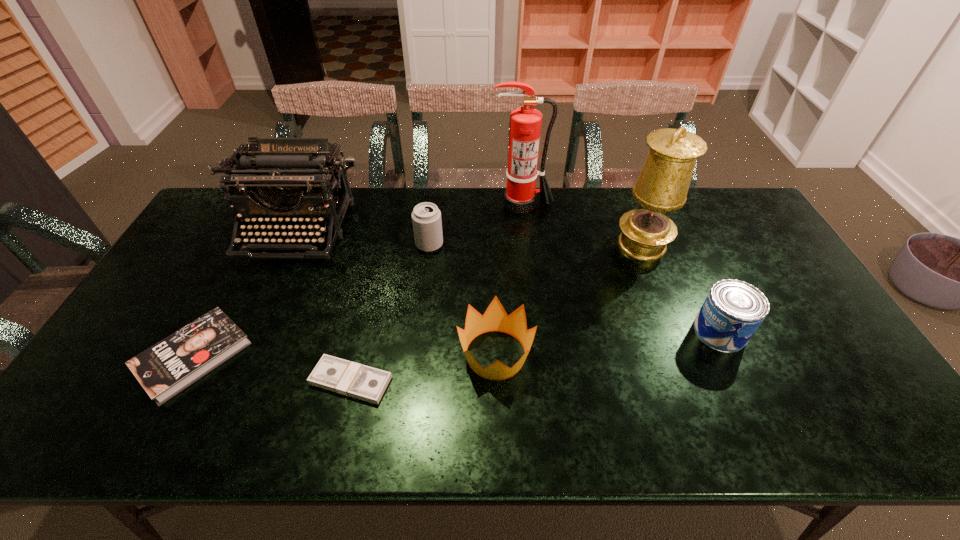
Locate an element on the screen. The height and width of the screenshot is (540, 960). object that is the seventh closest one to the fifth object from right to left is located at coordinates (733, 310).

Select which object appears as the seventh closest to the nearer can. Please provide its 2D coordinates. Your answer should be formatted as a tuple, i.e. [(x, y)], where the tuple contains the x and y coordinates of a point satisfying the conditions above.

[(165, 369)]

Locate an element on the screen. Image resolution: width=960 pixels, height=540 pixels. free space that satisfies the following two spatial constraints: 1. on the back side of the second shortest object; 2. on the right side of the fourth object from left to right is located at coordinates (253, 245).

You are a GUI agent. You are given a task and a screenshot of the screen. Output one action in this format:
    pyautogui.click(x=<x>, y=<y>)
    Task: Click on the blank area in the image that satisfies the following two spatial constraints: 1. on the back side of the shortest object; 2. on the left side of the left can
    The width and height of the screenshot is (960, 540).
    Given the screenshot: What is the action you would take?
    pyautogui.click(x=382, y=245)